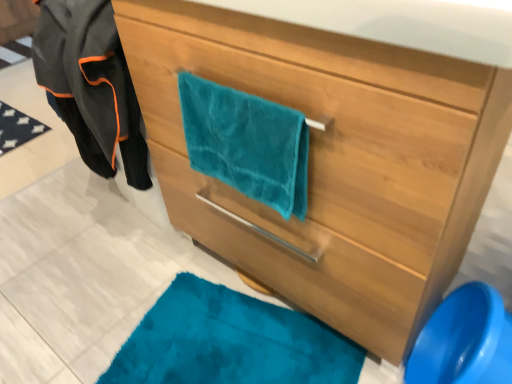
The height and width of the screenshot is (384, 512). I want to click on free space above teal fabric towel at center (from a real-world perspective), so click(142, 298).